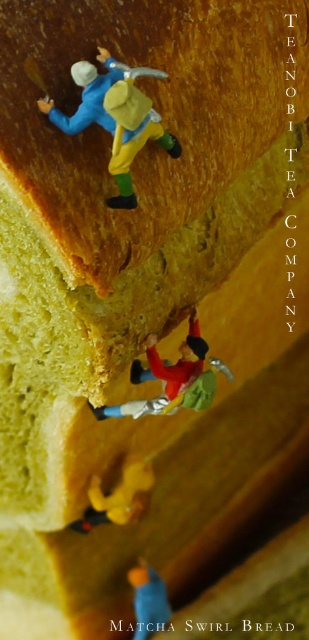
Question: Among these objects, which one is farthest from the camera?

Choices:
 (A) yellow matte toy at lower center
 (B) red fabric climbing gear at center

Answer: (A)

Question: Which object is positioned closest to the blue matte toy at lower center?

Choices:
 (A) yellow matte toy at lower center
 (B) red fabric climbing gear at center
 (C) matte yellow figure at upper center
 (D) matte plastic toy at upper left

Answer: (A)

Question: Which object is closer to the camera taking this photo?

Choices:
 (A) yellow matte toy at lower center
 (B) blue matte toy at lower center
 (C) matte plastic toy at upper left

Answer: (C)

Question: Is matte plastic toy at upper left thinner than matte yellow figure at upper center?

Choices:
 (A) yes
 (B) no

Answer: (B)

Question: Is matte plastic toy at upper left bigger than blue matte toy at lower center?

Choices:
 (A) no
 (B) yes

Answer: (B)

Question: Can you confirm if matte plastic toy at upper left is bigger than red fabric climbing gear at center?

Choices:
 (A) no
 (B) yes

Answer: (A)